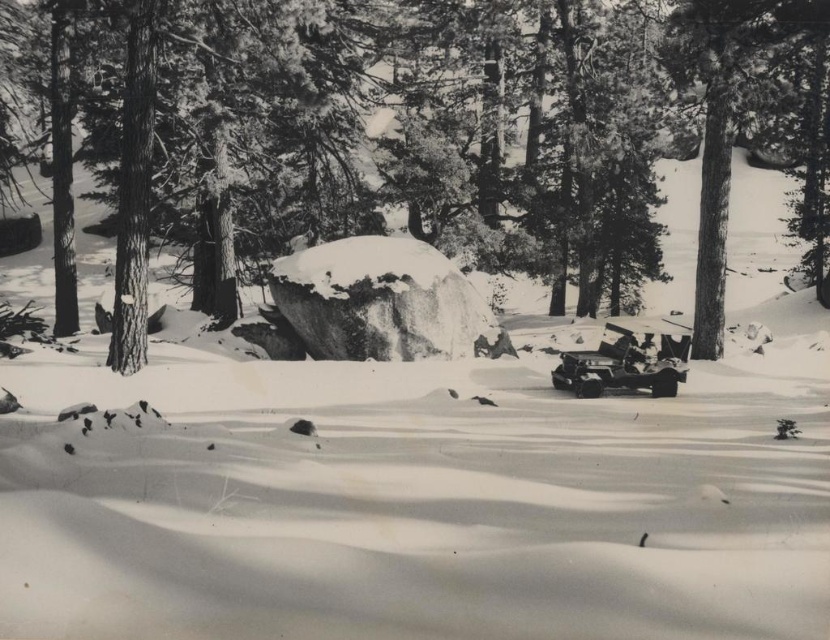
Question: Is smooth bark tree at center positioned at the back of metallic silver car at lower right?

Choices:
 (A) yes
 (B) no

Answer: (B)

Question: Among these objects, which one is nearest to the camera?

Choices:
 (A) smooth bark tree at center
 (B) metallic silver car at lower right
 (C) snow-covered rock at center

Answer: (A)

Question: Can you confirm if snow-covered rock at center is positioned to the left of metallic silver car at lower right?

Choices:
 (A) no
 (B) yes

Answer: (B)

Question: Is smooth bark tree at center closer to the viewer compared to metallic silver car at lower right?

Choices:
 (A) no
 (B) yes

Answer: (B)

Question: Which point appears closest to the camera in this image?

Choices:
 (A) (284, 195)
 (B) (652, 388)
 (C) (404, 355)

Answer: (B)

Question: Which point is closer to the camera?

Choices:
 (A) snow-covered rock at center
 (B) smooth bark tree at center
 (C) metallic silver car at lower right

Answer: (B)